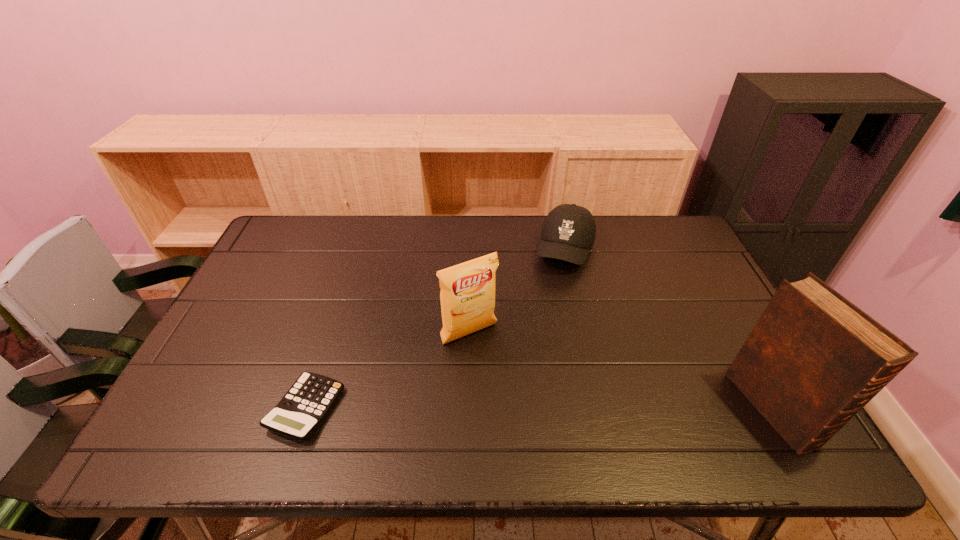
Where is `free spot that satisfies the following two spatial constraints: 1. on the back side of the Bible; 2. on the right side of the calculator`? The width and height of the screenshot is (960, 540). free spot that satisfies the following two spatial constraints: 1. on the back side of the Bible; 2. on the right side of the calculator is located at coordinates (306, 408).

The width and height of the screenshot is (960, 540). I want to click on vacant region that satisfies the following two spatial constraints: 1. on the front side of the third tallest object; 2. on the left side of the Bible, so click(x=602, y=408).